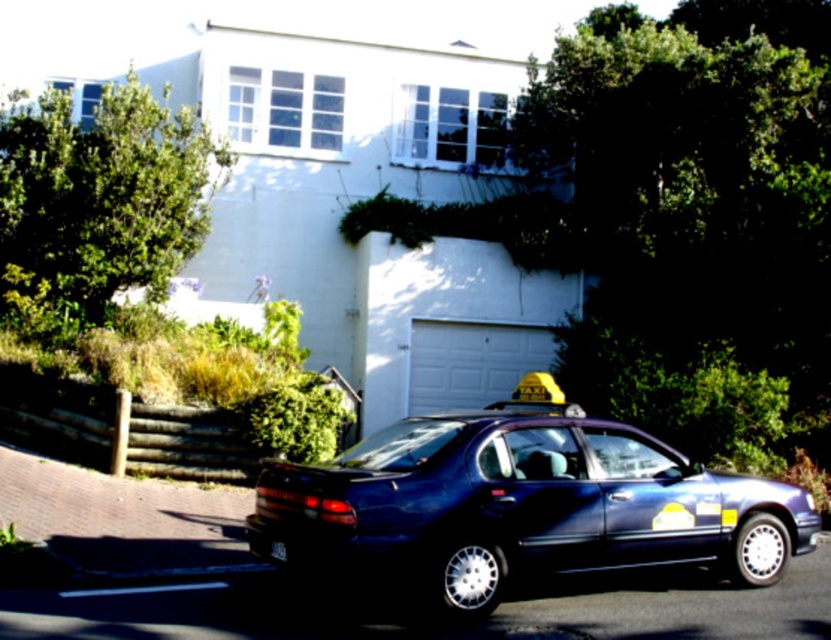
Does glossy blue sedan at center have a larger size compared to black plastic license plate at lower center?

Indeed, glossy blue sedan at center has a larger size compared to black plastic license plate at lower center.

Is glossy blue sedan at center thinner than black plastic license plate at lower center?

Incorrect, glossy blue sedan at center's width is not less than black plastic license plate at lower center's.

Identify the location of glossy blue sedan at center. (520, 508).

You are a GUI agent. You are given a task and a screenshot of the screen. Output one action in this format:
    pyautogui.click(x=<x>, y=<y>)
    Task: Click on the glossy blue sedan at center
    The height and width of the screenshot is (640, 831).
    Given the screenshot: What is the action you would take?
    pyautogui.click(x=520, y=508)

Measure the distance between yellow rubber taxi at center and black plastic license plate at lower center.

yellow rubber taxi at center is 18.89 feet from black plastic license plate at lower center.

Who is shorter, yellow rubber taxi at center or black plastic license plate at lower center?

black plastic license plate at lower center is shorter.

Locate an element on the screen. The width and height of the screenshot is (831, 640). yellow rubber taxi at center is located at coordinates (538, 396).

Is glossy blue sedan at center thinner than yellow rubber taxi at center?

Incorrect, glossy blue sedan at center's width is not less than yellow rubber taxi at center's.

Locate an element on the screen. This screenshot has height=640, width=831. glossy blue sedan at center is located at coordinates (520, 508).

Identify the location of glossy blue sedan at center. (520, 508).